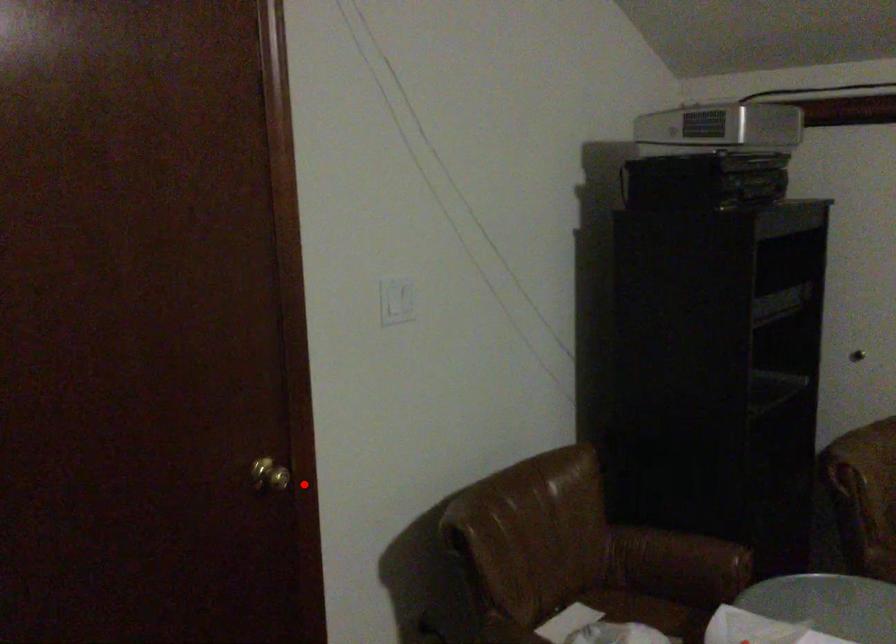
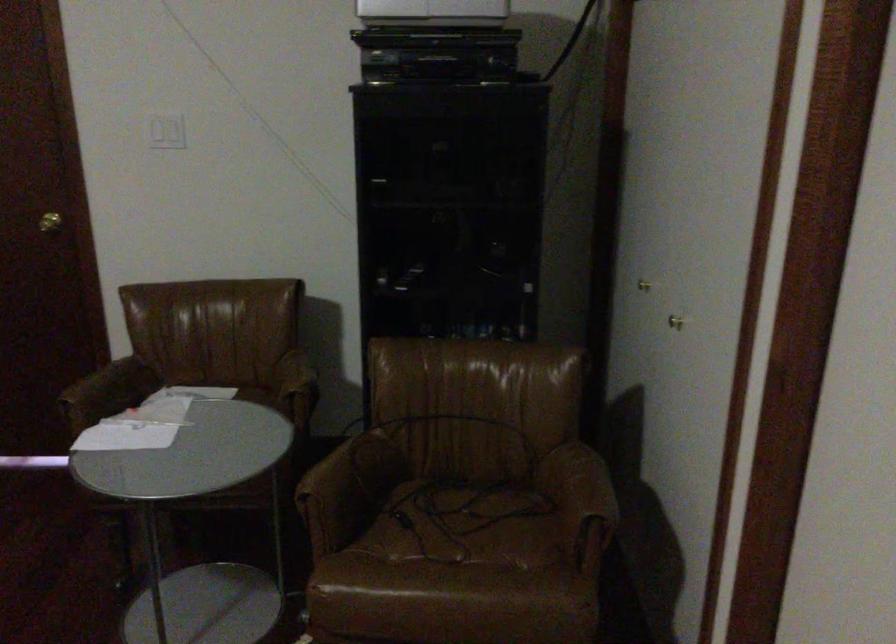
Find the pixel in the second image that matches the highlighted location in the first image.

(49, 222)